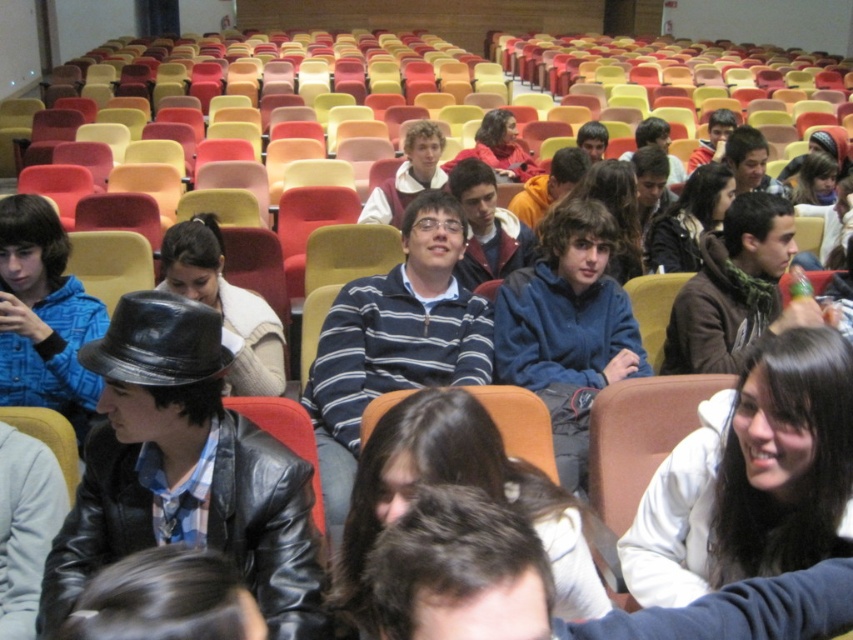
Question: Which of the following is the farthest from the observer?

Choices:
 (A) (178, 333)
 (B) (781, 186)
 (C) (663, 216)
 (D) (747, 220)

Answer: (B)

Question: Which point is farther to the camera?

Choices:
 (A) shiny black hat at center
 (B) striped sweater at center
 (C) brown leather jacket at center

Answer: (B)

Question: Which point is farther to the camera?

Choices:
 (A) brown fleece jacket at center-right
 (B) striped sweater at center
 (C) black leather hat at center

Answer: (B)

Question: Can you confirm if shiny black hat at left is positioned to the left of white matte jacket at center right?

Choices:
 (A) yes
 (B) no

Answer: (A)

Question: Is white matte jacket at center right further to the viewer compared to matte red sweater at center?

Choices:
 (A) yes
 (B) no

Answer: (B)

Question: Can you confirm if blue striped sweater at center is smaller than matte black hat at upper right?

Choices:
 (A) yes
 (B) no

Answer: (A)